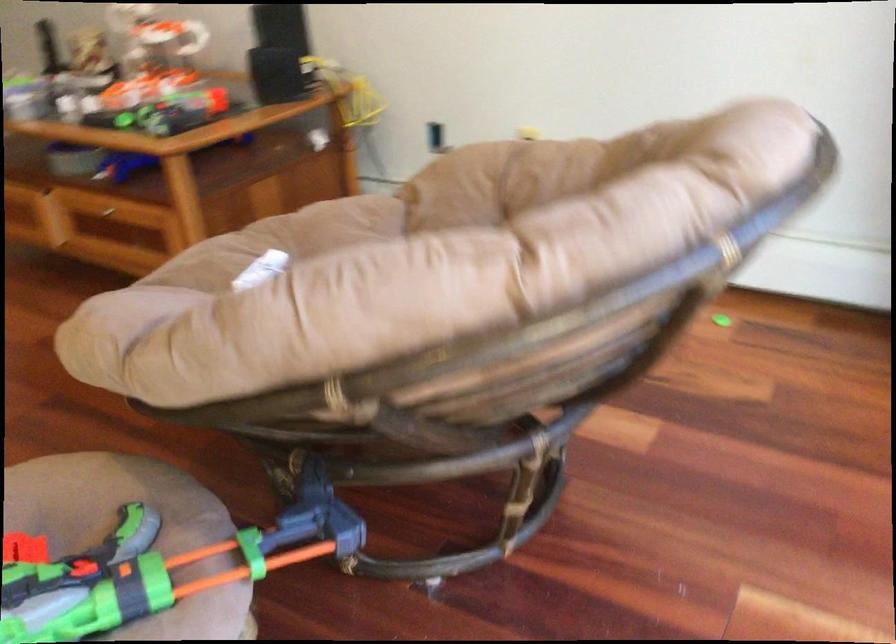
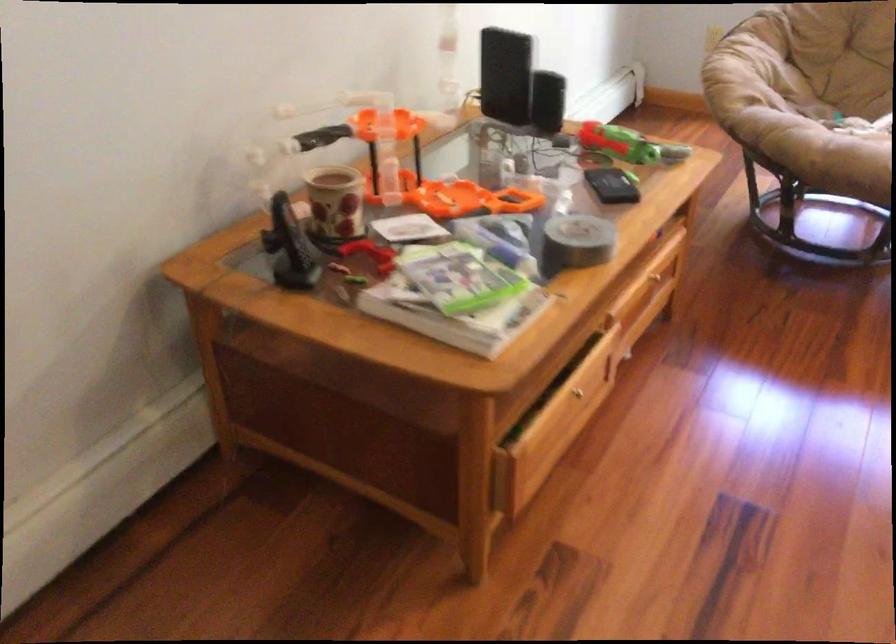
The point at (102, 210) is marked in the first image. Where is the corresponding point in the second image?

(653, 277)